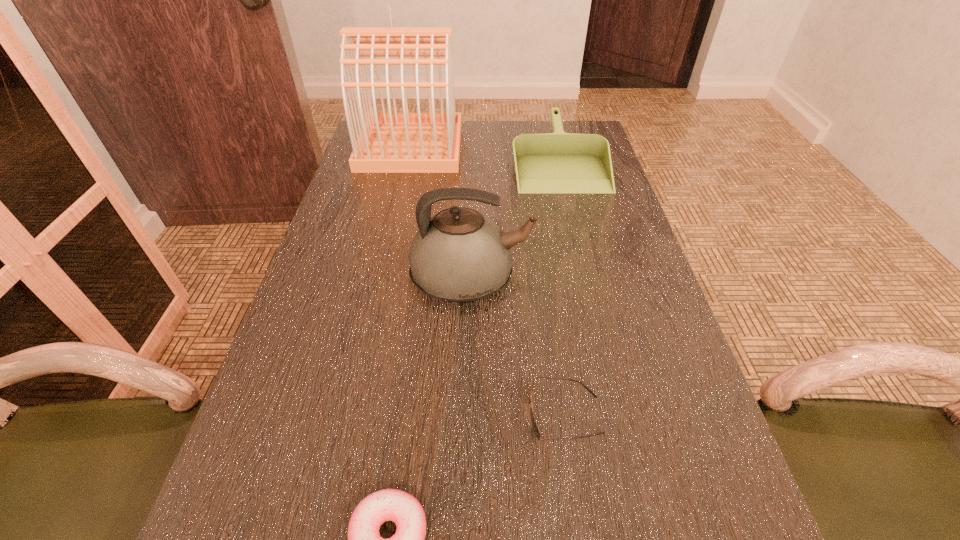
Identify the location of birdcage. The image size is (960, 540). (388, 142).

Image resolution: width=960 pixels, height=540 pixels. I want to click on the second tallest object, so click(x=458, y=255).

This screenshot has width=960, height=540. I want to click on the third nearest object, so click(x=458, y=255).

Identify the location of the third tallest object. This screenshot has height=540, width=960. (558, 162).

Locate an element on the screen. The height and width of the screenshot is (540, 960). sunglasses is located at coordinates (534, 425).

Identify the location of free space located with an open door on the birdcage. (494, 146).

The width and height of the screenshot is (960, 540). I want to click on blank area located at the spout of the third farthest object, so click(x=643, y=279).

The width and height of the screenshot is (960, 540). In order to click on vacant space situated 0.330m on the scoop of the third tallest object in this screenshot , I will do `click(588, 279)`.

What are the coordinates of `free location located on the front-facing side of the sunglasses` in the screenshot? It's located at (469, 415).

Locate an element on the screen. The image size is (960, 540). free spot located on the front-facing side of the sunglasses is located at coordinates (293, 415).